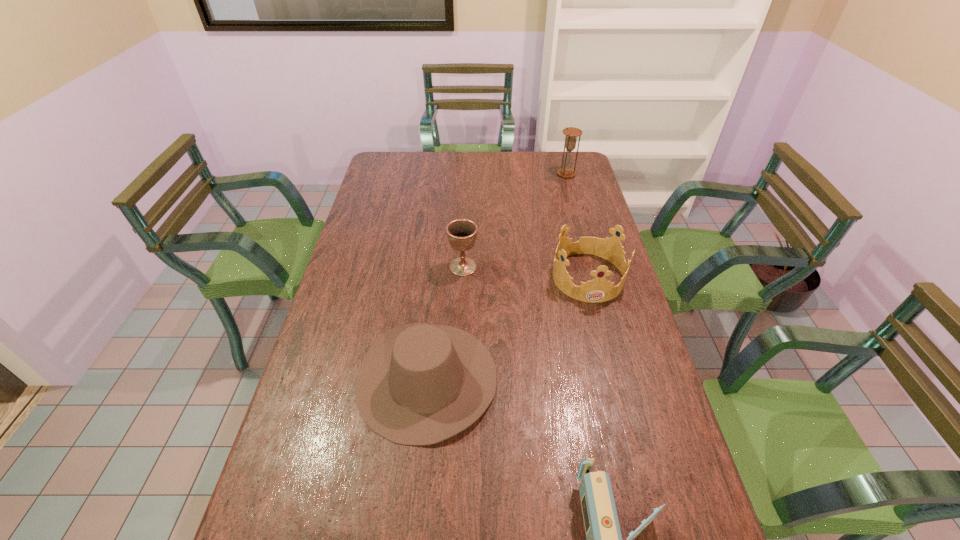
Find the location of a particular element. object located at the left edge is located at coordinates (419, 384).

At what (x,y) coordinates should I click in order to perform the action: click on hourglass present at the right edge. Please return your answer as a coordinate pair (x, y). This screenshot has width=960, height=540. Looking at the image, I should click on (566, 171).

At what (x,y) coordinates should I click in order to perform the action: click on tiara that is at the right edge. Please return your answer as a coordinate pair (x, y). This screenshot has width=960, height=540. Looking at the image, I should click on (598, 290).

Find the location of a particular element. The image size is (960, 540). object at the far right corner is located at coordinates (566, 171).

The width and height of the screenshot is (960, 540). I want to click on vacant region at the far edge of the desktop, so click(x=543, y=177).

You are a GUI agent. You are given a task and a screenshot of the screen. Output one action in this format:
    pyautogui.click(x=<x>, y=<y>)
    Task: Click on the vacant space at the left edge of the desktop
    The width and height of the screenshot is (960, 540).
    Given the screenshot: What is the action you would take?
    (x=345, y=257)

Locate an element on the screen. Image resolution: width=960 pixels, height=540 pixels. vacant region at the right edge of the desktop is located at coordinates (586, 195).

Where is `free space that is in between the hourglass and the chalice`? free space that is in between the hourglass and the chalice is located at coordinates (515, 220).

At what (x,y) coordinates should I click in order to perform the action: click on empty space that is in between the tiara and the hourglass. Please return your answer as a coordinate pair (x, y). The width and height of the screenshot is (960, 540). Looking at the image, I should click on (577, 225).

The width and height of the screenshot is (960, 540). I want to click on vacant area that lies between the tiara and the fourth farthest object, so click(507, 327).